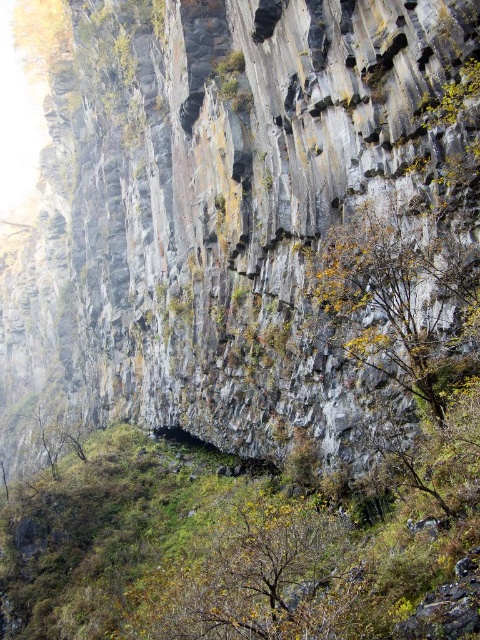
Question: Does yellow-green leaves at center-right have a smaller size compared to green leafy tree at lower left?

Choices:
 (A) yes
 (B) no

Answer: (A)

Question: From the image, what is the correct spatial relationship of yellow-green leaves at center-right in relation to green leafy tree at lower left?

Choices:
 (A) above
 (B) below

Answer: (A)

Question: From the image, what is the correct spatial relationship of yellow-green leaves at center-right in relation to green leafy tree at lower left?

Choices:
 (A) below
 (B) above

Answer: (B)

Question: Which point is farther to the camera?

Choices:
 (A) (469, 273)
 (B) (54, 420)

Answer: (B)